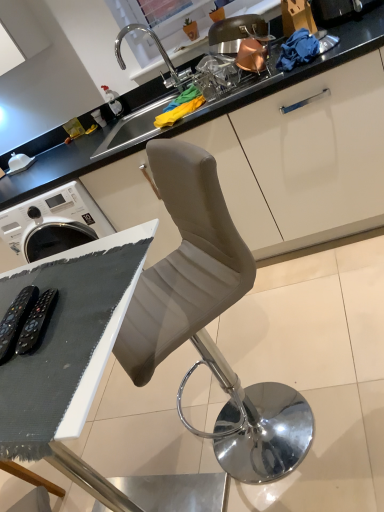
Question: Is satin nickel sink at upper center beside suede-like gray chair at center?

Choices:
 (A) no
 (B) yes

Answer: (A)

Question: From a real-world perspective, is satin nickel sink at upper center on suede-like gray chair at center?

Choices:
 (A) no
 (B) yes

Answer: (B)

Question: Considering the relative sizes of satin nickel sink at upper center and suede-like gray chair at center in the image provided, is satin nickel sink at upper center wider than suede-like gray chair at center?

Choices:
 (A) no
 (B) yes

Answer: (A)

Question: Can suede-like gray chair at center be found inside satin nickel sink at upper center?

Choices:
 (A) yes
 (B) no

Answer: (B)

Question: Is satin nickel sink at upper center at the right side of suede-like gray chair at center?

Choices:
 (A) yes
 (B) no

Answer: (B)

Question: Is matte white cabinet at upper center taller or shorter than satin nickel sink at upper center?

Choices:
 (A) tall
 (B) short

Answer: (A)

Question: Considering the relative positions of matte white cabinet at upper center and satin nickel sink at upper center in the image provided, is matte white cabinet at upper center to the left or to the right of satin nickel sink at upper center?

Choices:
 (A) left
 (B) right

Answer: (A)

Question: From the image's perspective, relative to satin nickel sink at upper center, is matte white cabinet at upper center above or below?

Choices:
 (A) below
 (B) above

Answer: (A)

Question: Does point (8, 178) appear closer or farther from the camera than point (221, 29)?

Choices:
 (A) closer
 (B) farther

Answer: (B)

Question: Is white matte table at lower left situated inside suede-like gray chair at center or outside?

Choices:
 (A) outside
 (B) inside

Answer: (A)

Question: Is white matte table at lower left taller or shorter than suede-like gray chair at center?

Choices:
 (A) tall
 (B) short

Answer: (B)

Question: Considering the relative positions of white matte table at lower left and suede-like gray chair at center in the image provided, is white matte table at lower left to the left or to the right of suede-like gray chair at center?

Choices:
 (A) left
 (B) right

Answer: (A)

Question: From a real-world perspective, is white matte table at lower left positioned above or below suede-like gray chair at center?

Choices:
 (A) above
 (B) below

Answer: (A)

Question: Does point (144, 364) appear closer or farther from the camera than point (258, 106)?

Choices:
 (A) farther
 (B) closer

Answer: (B)

Question: Relative to matte white cabinet at upper center, is suede-like gray chair at center in front or behind?

Choices:
 (A) front
 (B) behind

Answer: (A)